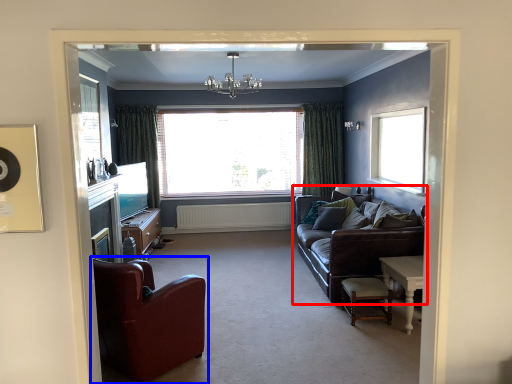
Question: Which object appears farthest to the camera in this image, studio couch (highlighted by a red box) or chair (highlighted by a blue box)?

Choices:
 (A) studio couch
 (B) chair

Answer: (A)